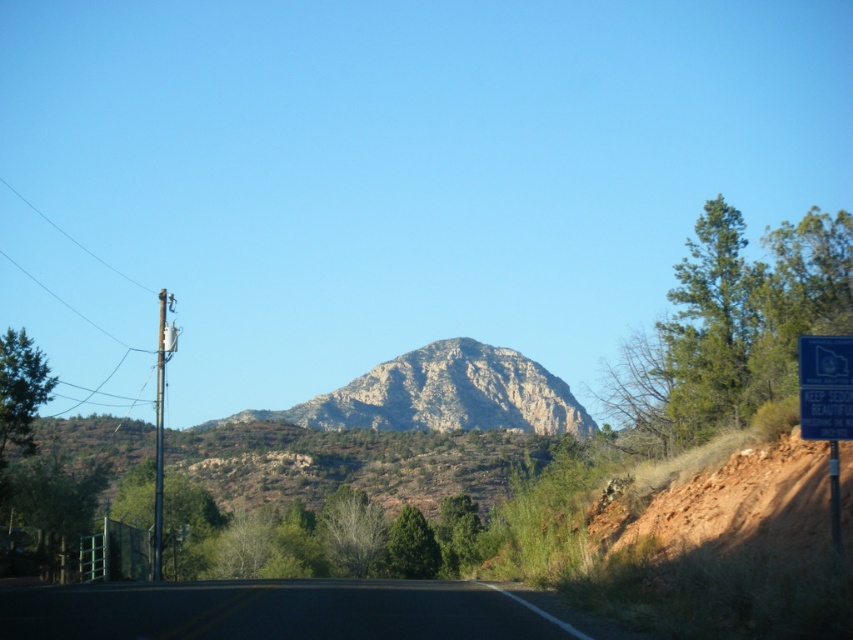
Does black asphalt road at center have a smaller size compared to rugged stone mountain at center?

Yes, black asphalt road at center is smaller than rugged stone mountain at center.

Is black asphalt road at center above rugged stone mountain at center?

Yes.

Locate an element on the screen. black asphalt road at center is located at coordinates (281, 611).

Can you confirm if black asphalt road at center is positioned to the right of blue plastic sign at right?

Incorrect, black asphalt road at center is not on the right side of blue plastic sign at right.

Can you confirm if black asphalt road at center is positioned above blue plastic sign at right?

Incorrect, black asphalt road at center is not positioned above blue plastic sign at right.

Is point (351, 634) less distant than point (828, 413)?

Yes, point (351, 634) is in front of point (828, 413).

You are a GUI agent. You are given a task and a screenshot of the screen. Output one action in this format:
    pyautogui.click(x=<x>, y=<y>)
    Task: Click on the black asphalt road at center
    This screenshot has width=853, height=640.
    Given the screenshot: What is the action you would take?
    pyautogui.click(x=281, y=611)

Who is more forward, (349, 413) or (824, 388)?

Point (824, 388) is in front.

The width and height of the screenshot is (853, 640). I want to click on rugged stone mountain at center, so pyautogui.click(x=442, y=396).

Identify the location of rugged stone mountain at center. This screenshot has height=640, width=853. (442, 396).